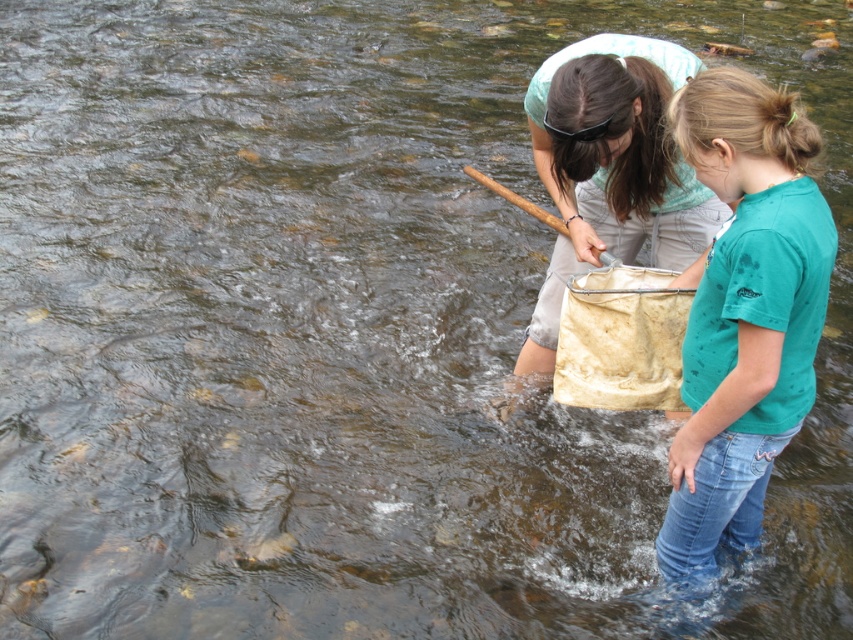
Question: Which point appears closest to the camera in this image?

Choices:
 (A) (636, 104)
 (B) (764, 196)

Answer: (B)

Question: Does teal matte shirt at right appear on the left side of light blue fabric net at center?

Choices:
 (A) yes
 (B) no

Answer: (B)

Question: Which object is farther from the camera taking this photo?

Choices:
 (A) light blue fabric net at center
 (B) teal matte shirt at right

Answer: (A)

Question: In this image, where is teal matte shirt at right located relative to light blue fabric net at center?

Choices:
 (A) right
 (B) left

Answer: (A)

Question: Is teal matte shirt at right below light blue fabric net at center?

Choices:
 (A) yes
 (B) no

Answer: (A)